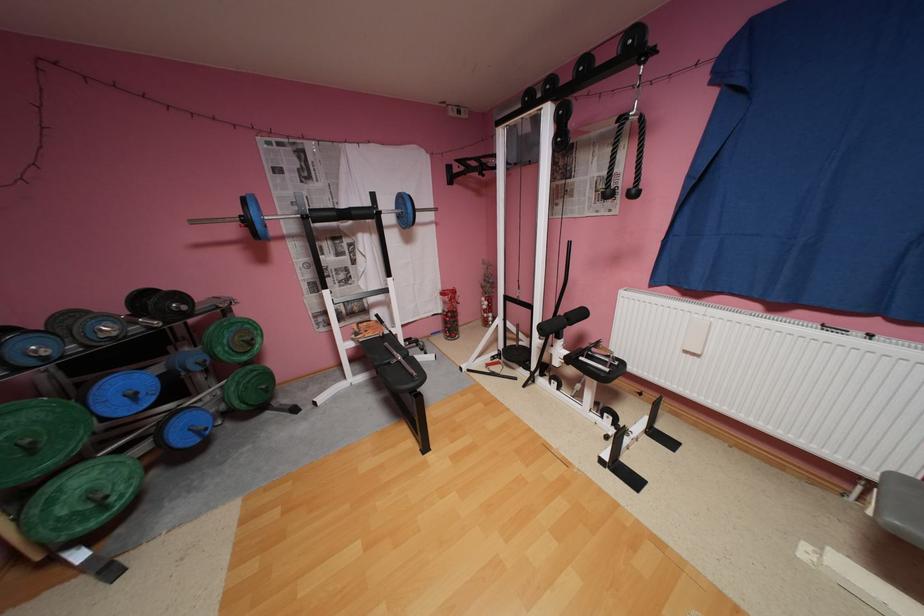
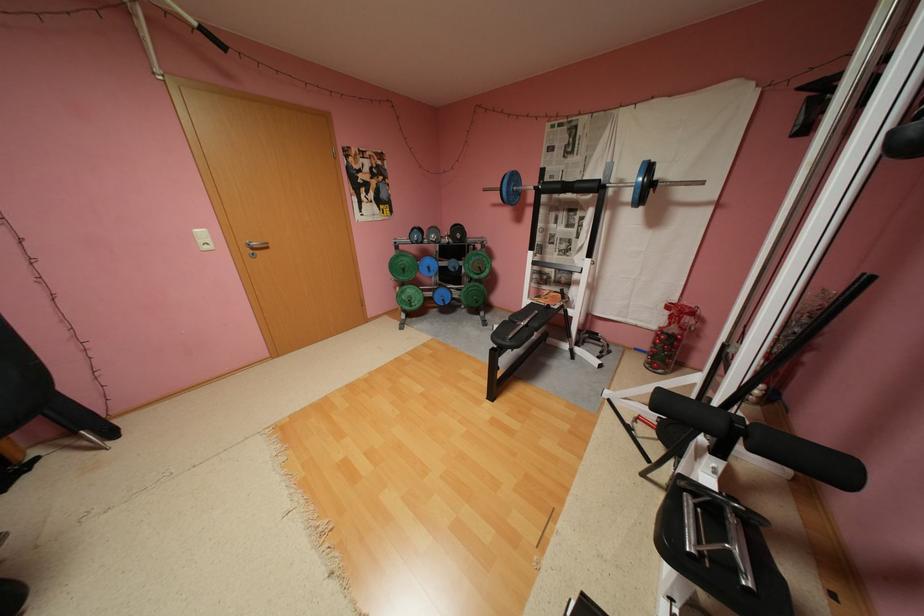
Where in the second image is the point corresponding to point (40, 448) from the first image?

(412, 270)